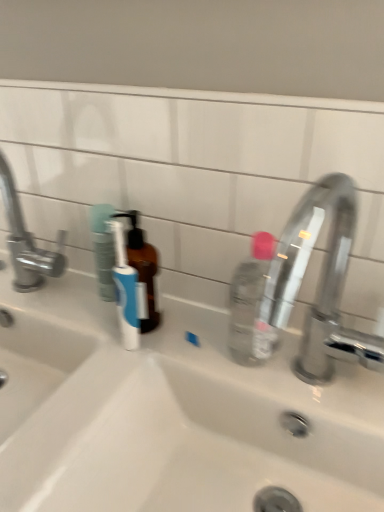
Question: Is brushed metal faucet at left, which is the first tap in left-to-right order, to the right of white ceramic sink at center from the viewer's perspective?

Choices:
 (A) no
 (B) yes

Answer: (A)

Question: Is brushed metal faucet at left, acting as the second tap starting from the right, thinner than white ceramic sink at center?

Choices:
 (A) no
 (B) yes

Answer: (B)

Question: Is white ceramic sink at center inside brushed metal faucet at left, which is the first tap in left-to-right order?

Choices:
 (A) no
 (B) yes

Answer: (A)

Question: From a real-world perspective, does brushed metal faucet at left, which is the first tap in left-to-right order, stand above white ceramic sink at center?

Choices:
 (A) no
 (B) yes

Answer: (B)

Question: Is the surface of brushed metal faucet at left, which is the first tap in left-to-right order, in direct contact with white ceramic sink at center?

Choices:
 (A) yes
 (B) no

Answer: (B)

Question: Does brushed metal faucet at left, which is the first tap in left-to-right order, lie behind white ceramic sink at center?

Choices:
 (A) yes
 (B) no

Answer: (A)

Question: Considering the relative sizes of polished chrome faucet at right, which is counted as the second tap, starting from the left, and white ceramic sink at center in the image provided, is polished chrome faucet at right, which is counted as the second tap, starting from the left, taller than white ceramic sink at center?

Choices:
 (A) no
 (B) yes

Answer: (A)

Question: From a real-world perspective, does polished chrome faucet at right, arranged as the 1th tap when viewed from the right, stand above white ceramic sink at center?

Choices:
 (A) yes
 (B) no

Answer: (A)

Question: From a real-world perspective, is polished chrome faucet at right, arranged as the 1th tap when viewed from the right, located beneath white ceramic sink at center?

Choices:
 (A) no
 (B) yes

Answer: (A)

Question: Is polished chrome faucet at right, arranged as the 1th tap when viewed from the right, looking in the opposite direction of white ceramic sink at center?

Choices:
 (A) no
 (B) yes

Answer: (A)

Question: Considering the relative positions of polished chrome faucet at right, arranged as the 1th tap when viewed from the right, and white ceramic sink at center in the image provided, is polished chrome faucet at right, arranged as the 1th tap when viewed from the right, behind white ceramic sink at center?

Choices:
 (A) no
 (B) yes

Answer: (B)

Question: Does polished chrome faucet at right, which is counted as the second tap, starting from the left, have a larger size compared to white ceramic sink at center?

Choices:
 (A) yes
 (B) no

Answer: (B)

Question: Does brushed metal faucet at left, which is the first tap in left-to-right order, come behind polished chrome faucet at right, which is counted as the second tap, starting from the left?

Choices:
 (A) no
 (B) yes

Answer: (B)